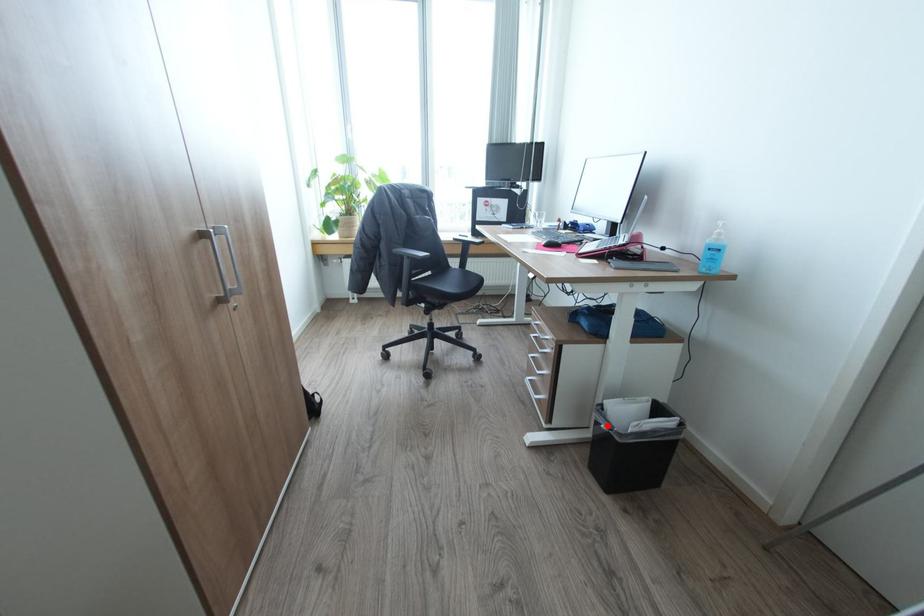
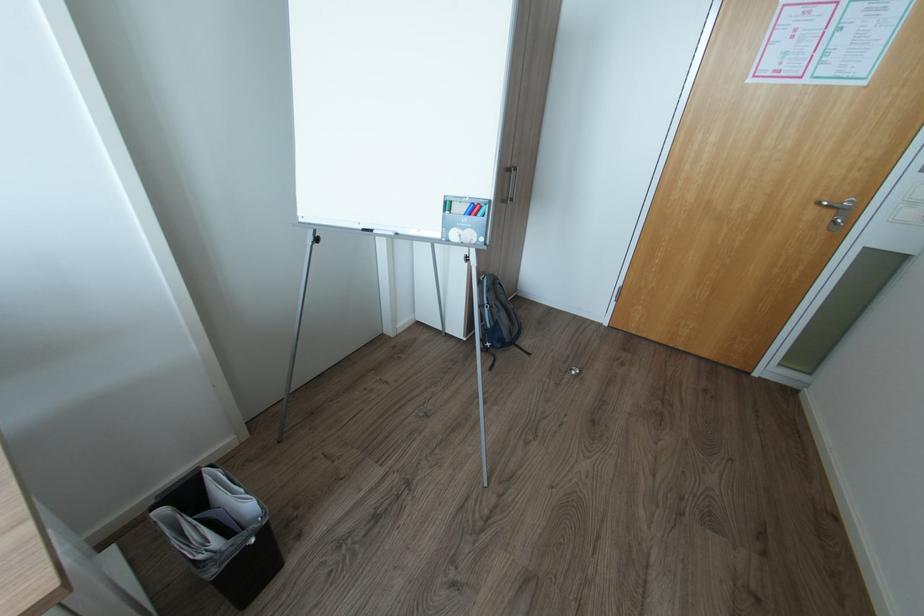
In the second image, find the point that corresponds to the highlighted location in the first image.

(257, 541)